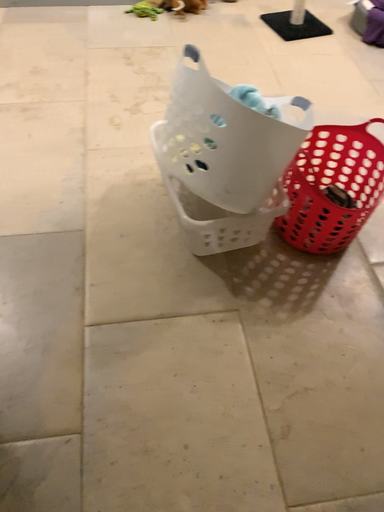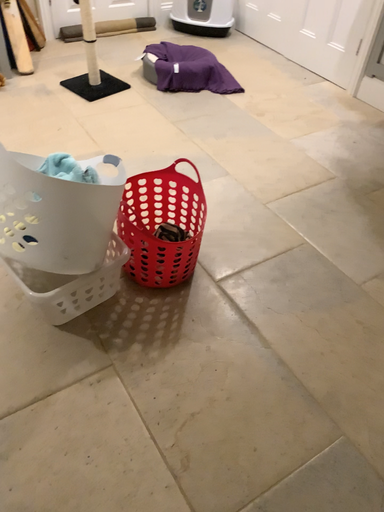
Question: How did the camera likely rotate when shooting the video?

Choices:
 (A) rotated right
 (B) rotated left

Answer: (A)